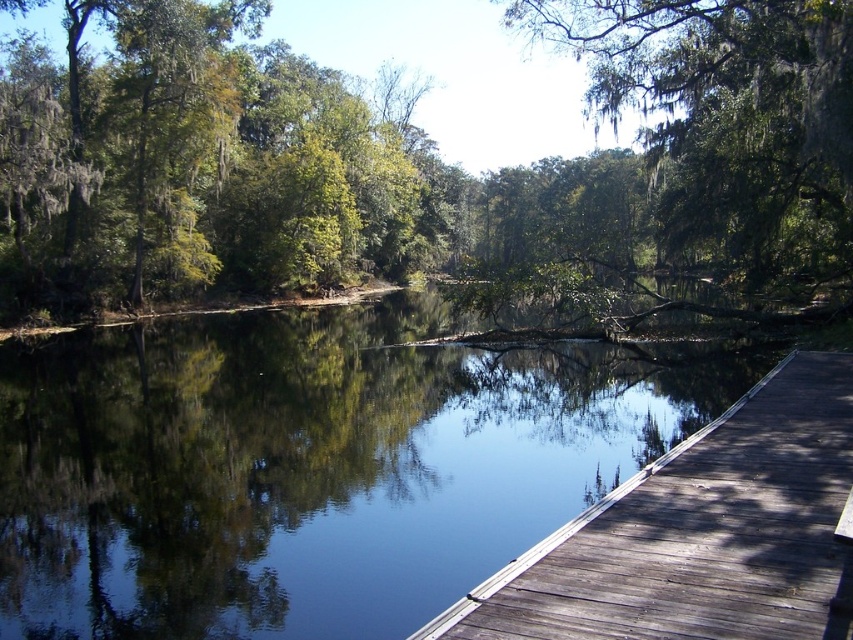
Question: Does smooth dark water at center have a smaller size compared to green mossy tree at upper center?

Choices:
 (A) no
 (B) yes

Answer: (B)

Question: Which of the following is the farthest from the observer?

Choices:
 (A) (825, 634)
 (B) (735, 65)
 (C) (132, 440)
 (D) (675, 93)

Answer: (D)

Question: Does smooth dark water at center have a greater width compared to green mossy tree at upper center?

Choices:
 (A) no
 (B) yes

Answer: (B)

Question: Which object is farther from the camera taking this photo?

Choices:
 (A) smooth dark water at center
 (B) dark brown wooden dock at lower right
 (C) green mossy tree at upper center
 (D) green leafy tree at center

Answer: (D)

Question: Can you confirm if green leafy tree at center is positioned to the right of dark brown wooden dock at lower right?

Choices:
 (A) no
 (B) yes

Answer: (A)

Question: Which point is farther to the camera?

Choices:
 (A) (297, 483)
 (B) (467, 236)
 (C) (791, 19)
 (D) (788, 448)

Answer: (B)